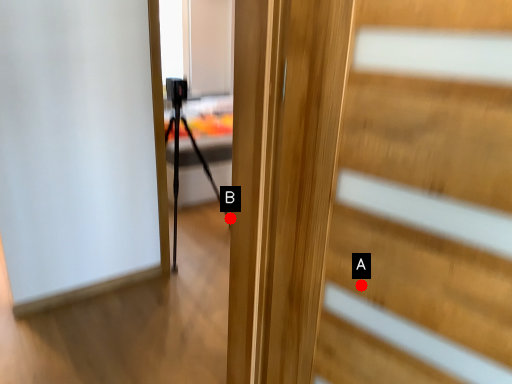
Question: Two points are circled on the image, labeled by A and B beside each circle. Among these points, which one is farthest from the camera?

Choices:
 (A) A is further
 (B) B is further

Answer: (B)